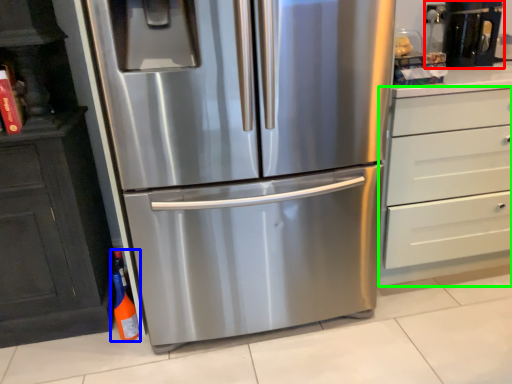
Question: Based on their relative distances, which object is farther from coffee machine (highlighted by a red box)? Choose from bottle (highlighted by a blue box) and chest of drawers (highlighted by a green box).

Choices:
 (A) bottle
 (B) chest of drawers

Answer: (A)